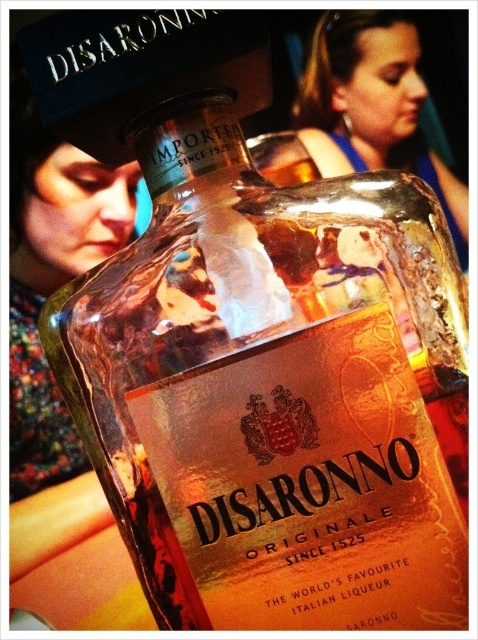
How much distance is there between matte black hat at upper left and blue fabric hairband at upper center?

matte black hat at upper left is 8.02 inches from blue fabric hairband at upper center.

In order to click on matte black hat at upper left in this screenshot , I will do `click(52, 278)`.

Which is behind, point (12, 401) or point (338, 106)?

Positioned behind is point (338, 106).

You are a GUI agent. You are given a task and a screenshot of the screen. Output one action in this format:
    pyautogui.click(x=<x>, y=<y>)
    Task: Click on the matte black hat at upper left
    The height and width of the screenshot is (640, 478).
    Given the screenshot: What is the action you would take?
    pyautogui.click(x=52, y=278)